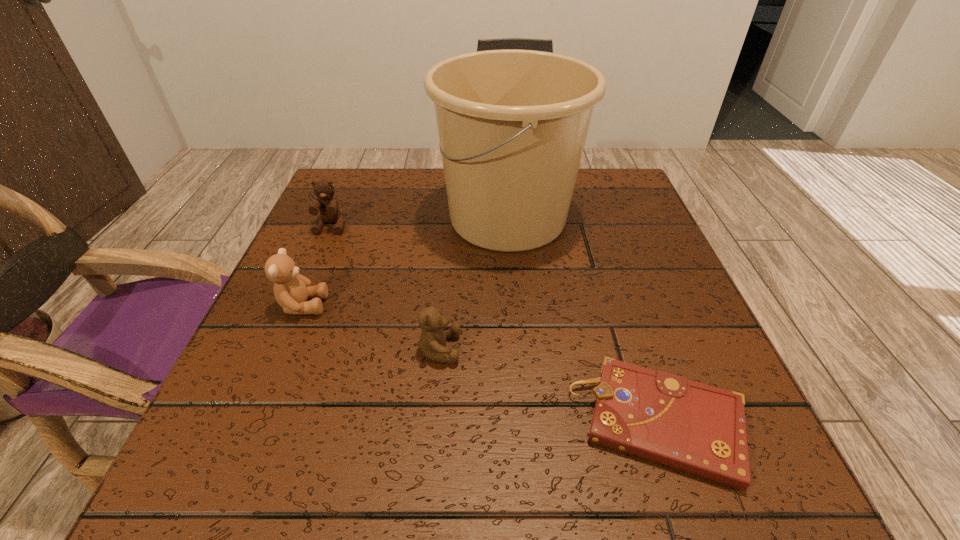
I want to click on the tallest object, so click(x=512, y=124).

The width and height of the screenshot is (960, 540). Identify the location of the second nearest teddy bear. click(x=291, y=289).

Where is `the farthest teddy bear`? The image size is (960, 540). the farthest teddy bear is located at coordinates (329, 212).

The height and width of the screenshot is (540, 960). Identify the location of the nearest teddy bear. (432, 342).

The width and height of the screenshot is (960, 540). What are the coordinates of `the shortest object` in the screenshot? It's located at (697, 428).

At what (x,y) coordinates should I click in order to perform the action: click on vacant area located 0.120m on the right of the bucket. Please return your answer as a coordinate pair (x, y). Looking at the image, I should click on (633, 218).

In order to click on free space located 0.060m on the face of the third farthest object in this screenshot , I will do pyautogui.click(x=359, y=305).

The width and height of the screenshot is (960, 540). I want to click on vacant space located 0.180m on the face of the farthest teddy bear, so click(302, 293).

Identify the location of free space located 0.050m on the front-facing side of the nearest teddy bear. (491, 349).

Find the location of a particular element. The height and width of the screenshot is (540, 960). vacant space situated 0.320m on the back of the notebook is located at coordinates (600, 242).